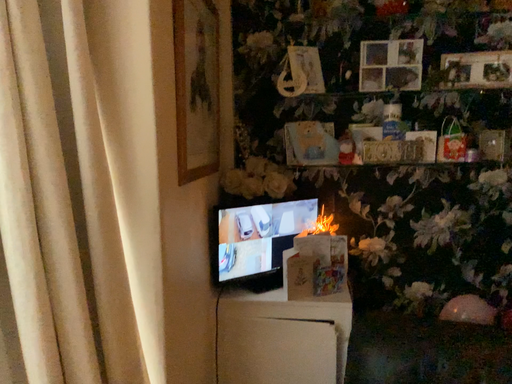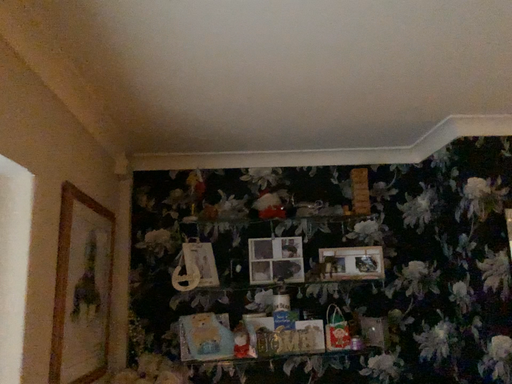
Question: How did the camera likely rotate when shooting the video?

Choices:
 (A) rotated upward
 (B) rotated downward

Answer: (A)